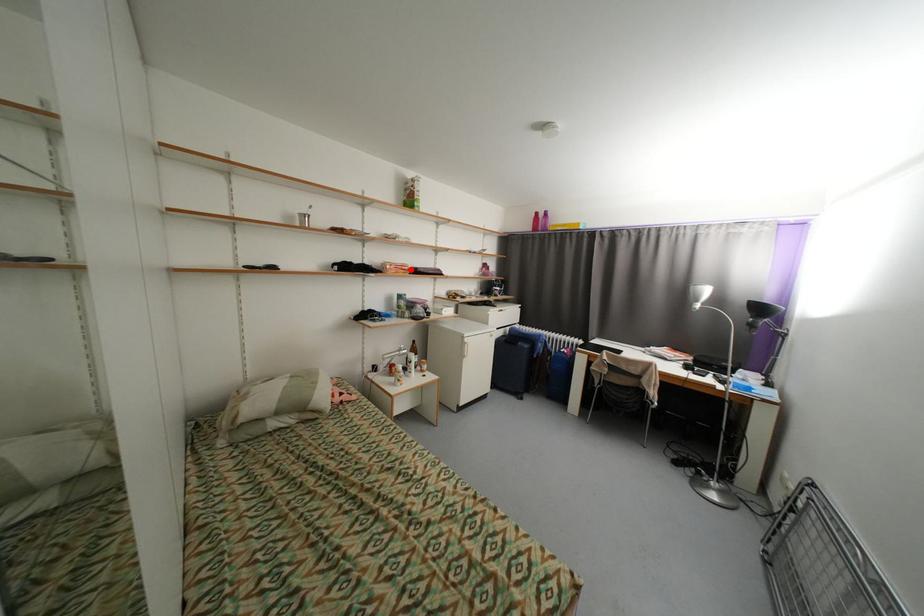
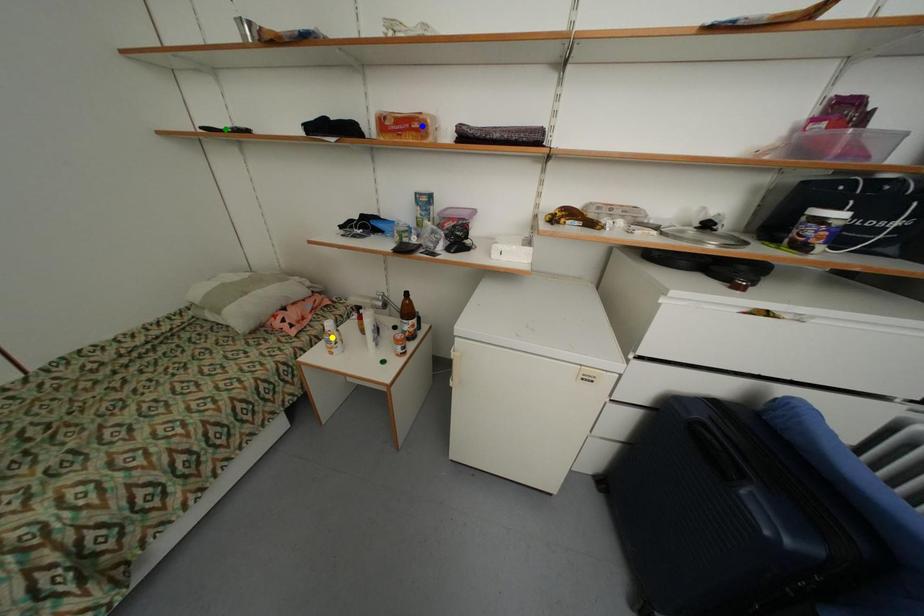
Question: I am providing you with two images of the same scene from different viewpoints. A red point is marked on the first image. You are given multiple points on the second image. Which spot in image 2 lines up with the point in image 1?

Choices:
 (A) green point
 (B) yellow point
 (C) blue point

Answer: (C)